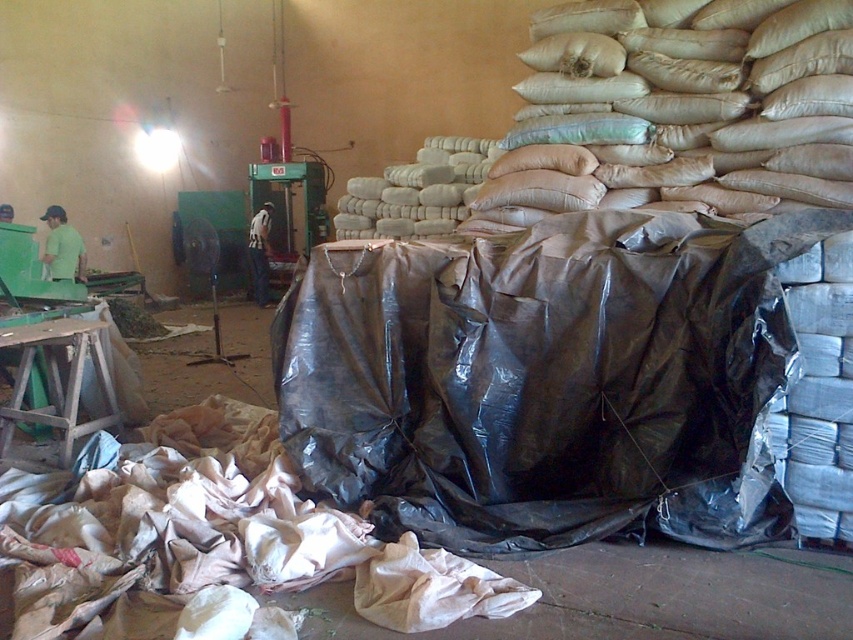
You are a warehouse worker who needs to move a box from the beige fabric sack at lower left to the white striped shirt at center. Can you safely walk between them without stepping on any obstacles?

The distance between the beige fabric sack at lower left and the white striped shirt at center is 7.04 meters. Since there are no obstacles mentioned in the scene description, you can safely walk between them.

You are a warehouse worker who needs to move items from the beige fabric sack at lower left to the green matte shirt at left. Can you carry both items at the same time if your carrying capacity is 5 meters?

The distance between the beige fabric sack at lower left and the green matte shirt at left is 4.94 meters. Since your carrying capacity is 5 meters, you can carry both items at the same time as the distance is within your capacity.